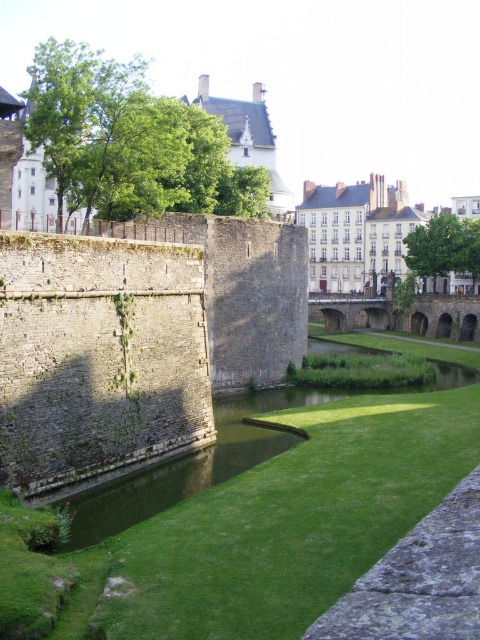
Does point (303, 390) come in front of point (451, 323)?

Yes.

Who is positioned more to the right, green grass at center or stone arch bridge at center?

Positioned to the right is stone arch bridge at center.

This screenshot has height=640, width=480. I want to click on green grass at center, so click(x=268, y=515).

The image size is (480, 640). Identify the location of green grass at center. (268, 515).